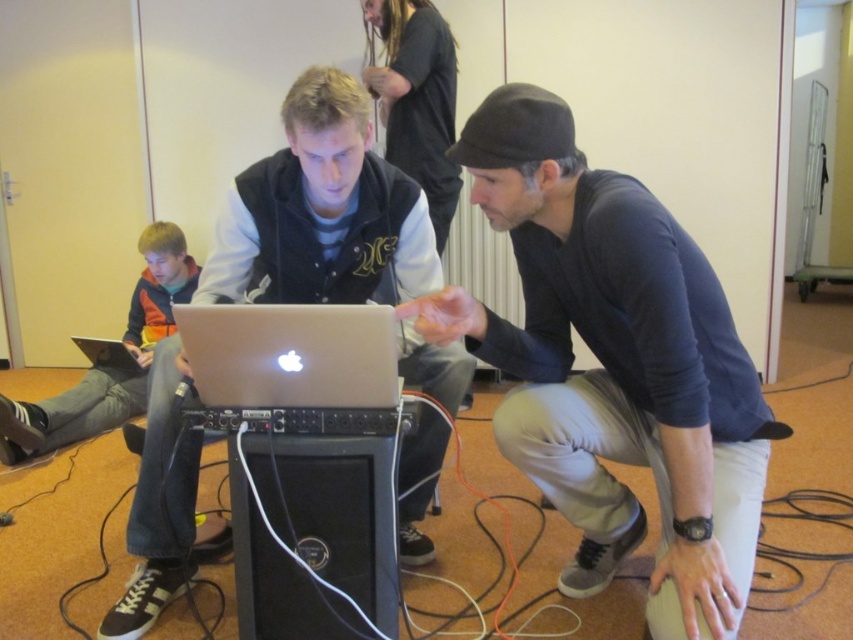
Based on the scene described, which object, the dark gray knit cap at center or the silver metallic laptop at center, is positioned closer to the observer?

The dark gray knit cap at center is positioned closer to the observer than the silver metallic laptop at center.

You are a photographer trying to capture a closeup of the matte black laptop at center without including the dark gray knit cap at center in the frame. Based on their sizes in the image, is this possible?

The dark gray knit cap at center occupies less space than the matte black laptop at center. Therefore, since the cap is smaller, it might be challenging to exclude it entirely if they are positioned closely together. However, adjusting the camera angle or zoom could help focus solely on the laptop.

In the scene where two men are collaborating around a laptop, where is the dark gray knit cap at center relative to the matte black laptop at center?

The dark gray knit cap at center is to the right of the matte black laptop at center.